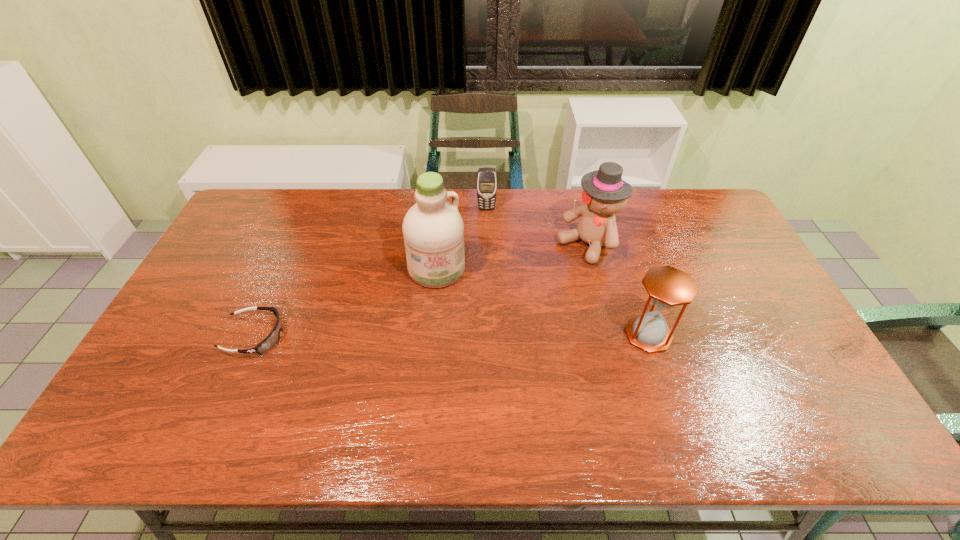
The height and width of the screenshot is (540, 960). I want to click on the leftmost object, so click(271, 340).

At what (x,y) coordinates should I click in order to perform the action: click on the shortest object. Please return your answer as a coordinate pair (x, y). Looking at the image, I should click on (271, 340).

This screenshot has height=540, width=960. In order to click on the third shortest object in this screenshot , I will do `click(667, 287)`.

Where is `the farthest object`? the farthest object is located at coordinates (486, 177).

Identify the location of cellular telephone. The width and height of the screenshot is (960, 540). (486, 177).

I want to click on cleansing agent, so click(433, 229).

Identify the location of the tallest object. The width and height of the screenshot is (960, 540). (433, 229).

Find the location of a particular element. rag_doll is located at coordinates (604, 194).

Locate an element on the screen. The width and height of the screenshot is (960, 540). vacant area situated on the front and sides of the leftmost object is located at coordinates (353, 336).

You are a GUI agent. You are given a task and a screenshot of the screen. Output one action in this format:
    pyautogui.click(x=<x>, y=<y>)
    Task: Click on the free space located 0.100m on the right of the third tallest object
    This screenshot has width=960, height=540.
    Given the screenshot: What is the action you would take?
    pos(708,334)